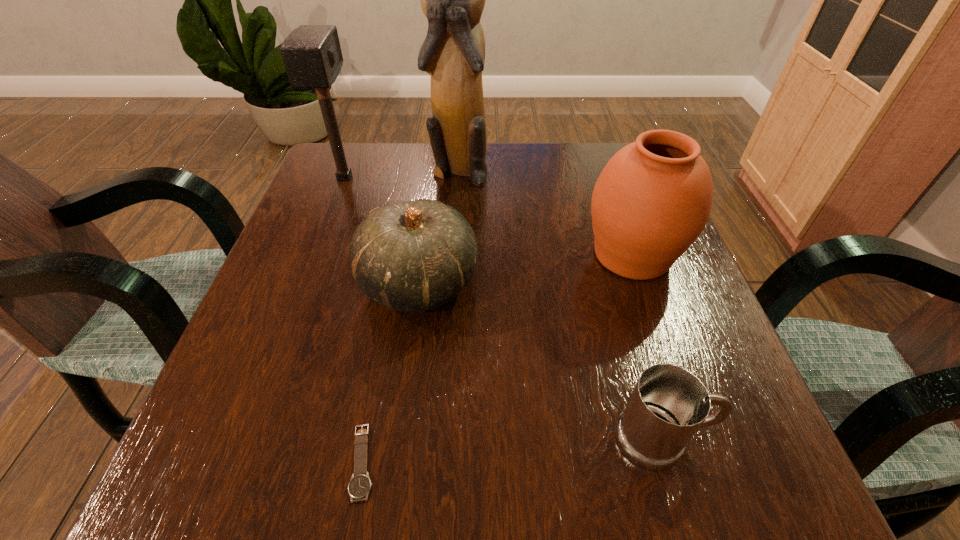
Locate an element on the screen. This screenshot has width=960, height=540. object located in the far left corner section of the desktop is located at coordinates (312, 55).

The height and width of the screenshot is (540, 960). In order to click on object that is at the near right corner in this screenshot , I will do `click(669, 404)`.

Identify the location of vacant area at the far edge. Image resolution: width=960 pixels, height=540 pixels. coord(414,152).

Find the location of a particular element. Image resolution: width=960 pixels, height=540 pixels. vacant area at the near edge of the desktop is located at coordinates (475, 488).

In the image, there is a desktop. Where is `vacant space at the left edge`? vacant space at the left edge is located at coordinates (274, 262).

Locate an element on the screen. The image size is (960, 540). vacant space at the right edge is located at coordinates (669, 299).

In the image, there is a desktop. At what (x,y) coordinates should I click in order to perform the action: click on free region at the near left corner. Please return your answer as a coordinate pair (x, y). Looking at the image, I should click on (296, 450).

At what (x,y) coordinates should I click in order to perform the action: click on vacant position at the near right corner of the desktop. Please return your answer as a coordinate pair (x, y). Looking at the image, I should click on (790, 491).

Where is `blank region between the mug and the fourth shortest object`? blank region between the mug and the fourth shortest object is located at coordinates (647, 347).

You are a GUI agent. You are given a task and a screenshot of the screen. Output one action in this format:
    pyautogui.click(x=<x>, y=<y>)
    Task: Click on the free area in between the second shortest object and the second tallest object
    
    Given the screenshot: What is the action you would take?
    pyautogui.click(x=503, y=308)